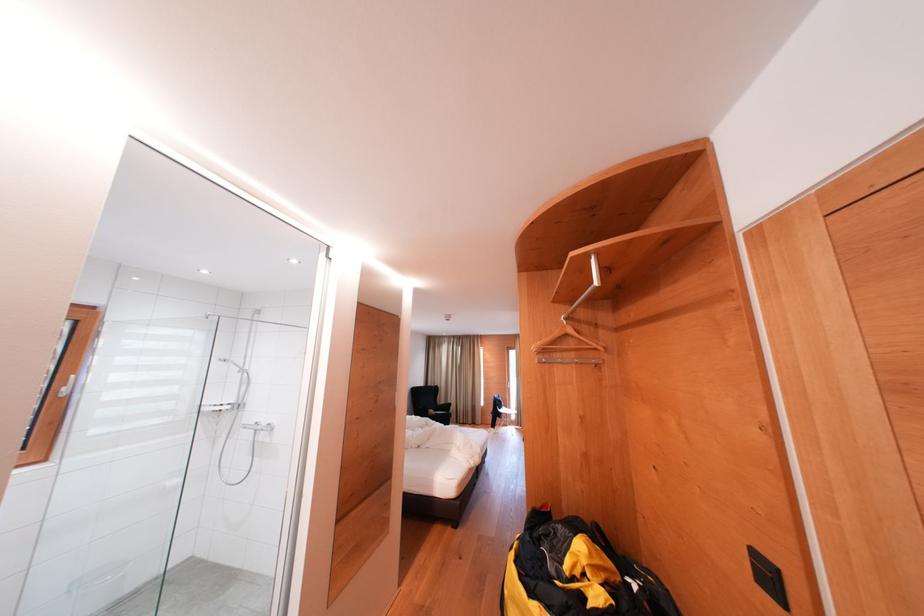
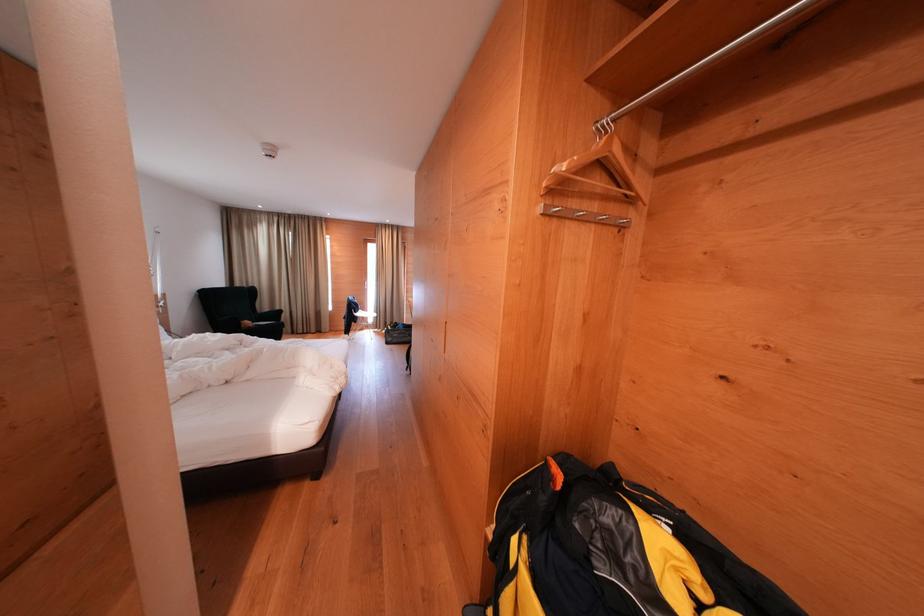
Locate, in the second image, the point that corresponds to (x=517, y=416) in the first image.

(374, 318)